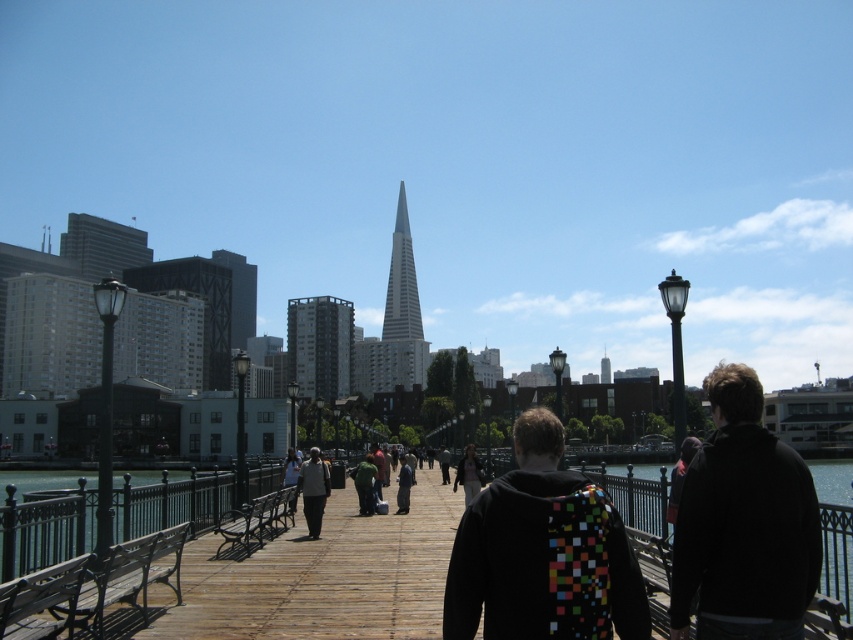
Question: Is multicolored pixelated backpack at center thinner than light brown leather jacket at center?

Choices:
 (A) no
 (B) yes

Answer: (A)

Question: Is multicolored pixelated backpack at center bigger than green fabric jacket at center?

Choices:
 (A) no
 (B) yes

Answer: (B)

Question: Which object is farther from the camera taking this photo?

Choices:
 (A) dark green jacket at center
 (B) light brown leather jacket at center

Answer: (A)

Question: Considering the real-world distances, which object is farthest from the clear glass water at center?

Choices:
 (A) dark green jacket at center
 (B) multicolored pixelated backpack at center
 (C) silver glass spire at center

Answer: (C)

Question: Which point is farther to the camera?

Choices:
 (A) light brown leather jacket at center
 (B) green fabric jacket at center
 (C) silver glass spire at center
 (D) multicolored pixelated backpack at center

Answer: (C)

Question: Is green matte jacket at center further to camera compared to green fabric jacket at center?

Choices:
 (A) no
 (B) yes

Answer: (A)